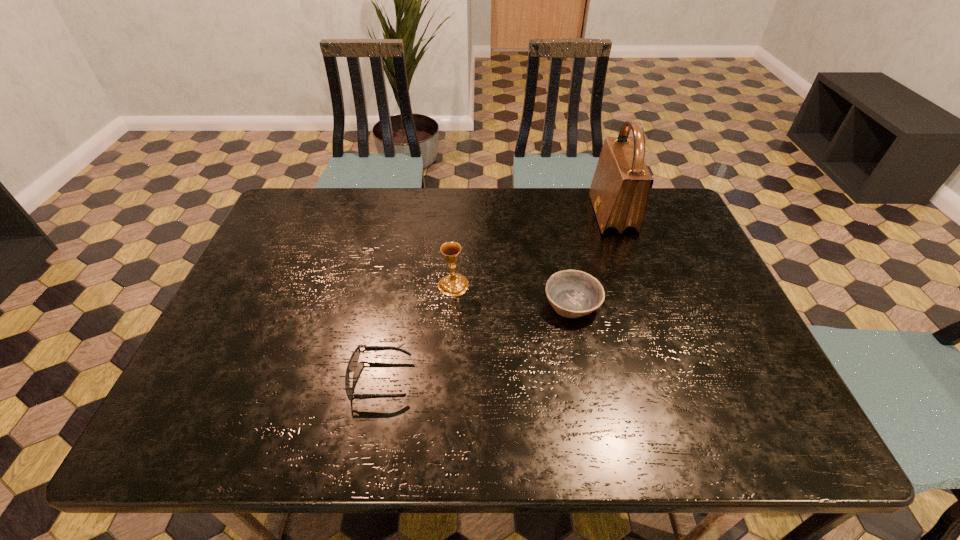
Where is `shoulder bag`? This screenshot has width=960, height=540. shoulder bag is located at coordinates (619, 191).

You are a GUI agent. You are given a task and a screenshot of the screen. Output one action in this format:
    pyautogui.click(x=<x>, y=<y>)
    Task: Click on the rightmost object
    
    Given the screenshot: What is the action you would take?
    pyautogui.click(x=619, y=191)

Find the location of a particular element. Image resolution: width=960 pixels, height=540 pixels. the second tallest object is located at coordinates (454, 284).

The image size is (960, 540). Find the location of `chalice`. chalice is located at coordinates (454, 284).

This screenshot has height=540, width=960. I want to click on the third object from left to right, so click(572, 293).

Identify the location of sunglasses. This screenshot has height=540, width=960. (354, 358).

Where is `the nearest object`? Image resolution: width=960 pixels, height=540 pixels. the nearest object is located at coordinates (354, 358).

Identify the location of free region located 0.260m on the front flap of the rightmost object. Image resolution: width=960 pixels, height=540 pixels. (511, 214).

You are a GUI agent. You are given a task and a screenshot of the screen. Output one action in this format:
    pyautogui.click(x=<x>, y=<y>)
    Task: Click on the free space located on the front flap of the rightmost object
    
    Given the screenshot: What is the action you would take?
    pos(548,214)

Locate an element on the screen. free space located on the front flap of the rightmost object is located at coordinates (504, 214).